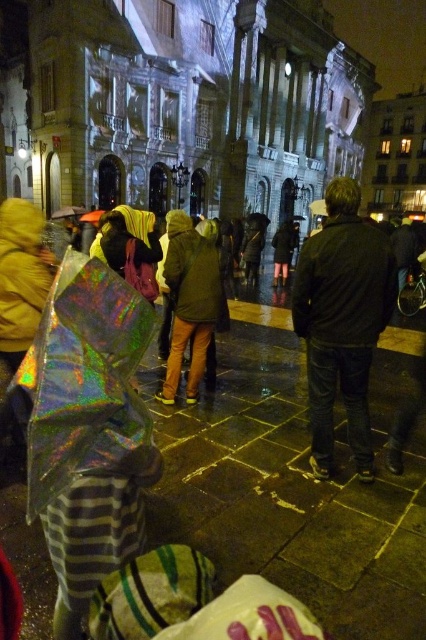
Question: Which is nearer to the holographic plastic bag at lower left?

Choices:
 (A) dark brown leather jacket at center
 (B) green matte jacket at center

Answer: (A)

Question: Does holographic plastic bag at lower left appear under green matte jacket at center?

Choices:
 (A) yes
 (B) no

Answer: (A)

Question: Is holographic plastic bag at lower left below dark brown leather jacket at center?

Choices:
 (A) yes
 (B) no

Answer: (A)

Question: Which point is farther to the camera?

Choices:
 (A) (218, 538)
 (B) (336, 273)

Answer: (B)

Question: Which of the following is the closest to the observer?

Choices:
 (A) (287, 381)
 (B) (184, 321)

Answer: (A)

Question: Is holographic plastic bag at lower left to the left of dark brown leather jacket at center from the viewer's perspective?

Choices:
 (A) no
 (B) yes

Answer: (B)